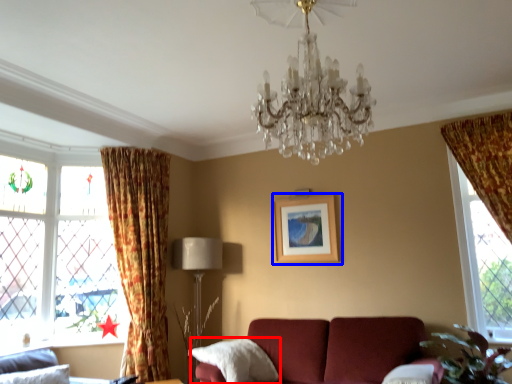
Question: Which object is further to the camera taking this photo, pillow (highlighted by a red box) or picture frame (highlighted by a blue box)?

Choices:
 (A) pillow
 (B) picture frame

Answer: (B)